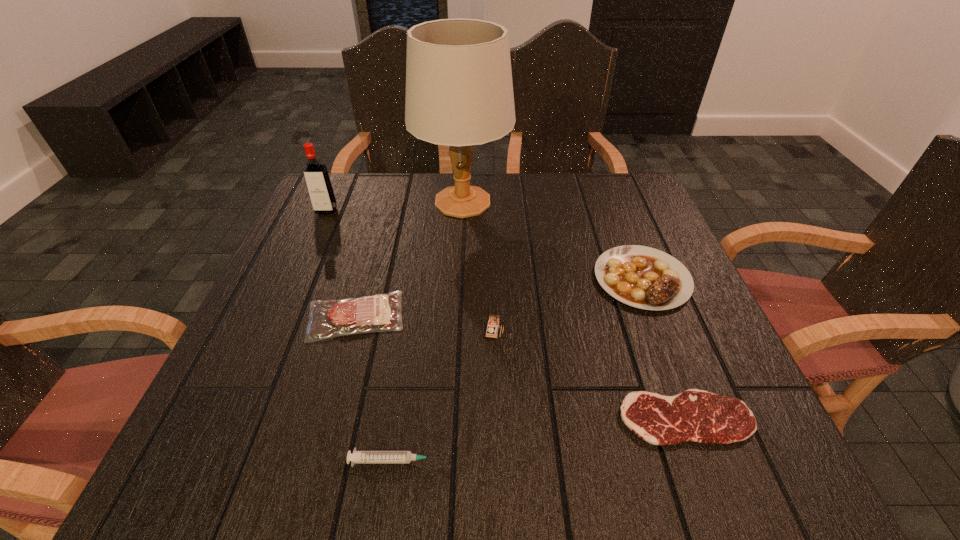
The height and width of the screenshot is (540, 960). I want to click on free point at the near right corner, so click(678, 447).

Where is `free space between the fifth shortest object and the table lamp`? free space between the fifth shortest object and the table lamp is located at coordinates coord(479,265).

The height and width of the screenshot is (540, 960). Identify the location of unoccupied area between the syringe and the third tallest object. (445, 394).

The width and height of the screenshot is (960, 540). I want to click on blank region between the tallest object and the syringe, so click(429, 331).

What are the coordinates of `vacant space in between the syringe and the fifth shortest object` in the screenshot? It's located at (445, 394).

At what (x,y) coordinates should I click in order to perform the action: click on free area in between the syringe and the table lamp. Please return your answer as a coordinate pair (x, y). This screenshot has width=960, height=540. Looking at the image, I should click on tap(429, 331).

Identify the location of vacant space in between the table lamp and the syringe. (429, 331).

Locate an element on the screen. Image resolution: width=960 pixels, height=540 pixels. vacant point located between the leftmost object and the matchbox is located at coordinates (410, 269).

Image resolution: width=960 pixels, height=540 pixels. I want to click on empty space that is in between the tallest object and the fourth shortest object, so (x=552, y=240).

Find the location of a particular element. This screenshot has height=540, width=960. vacant region between the matchbox and the second tallest steak is located at coordinates (425, 322).